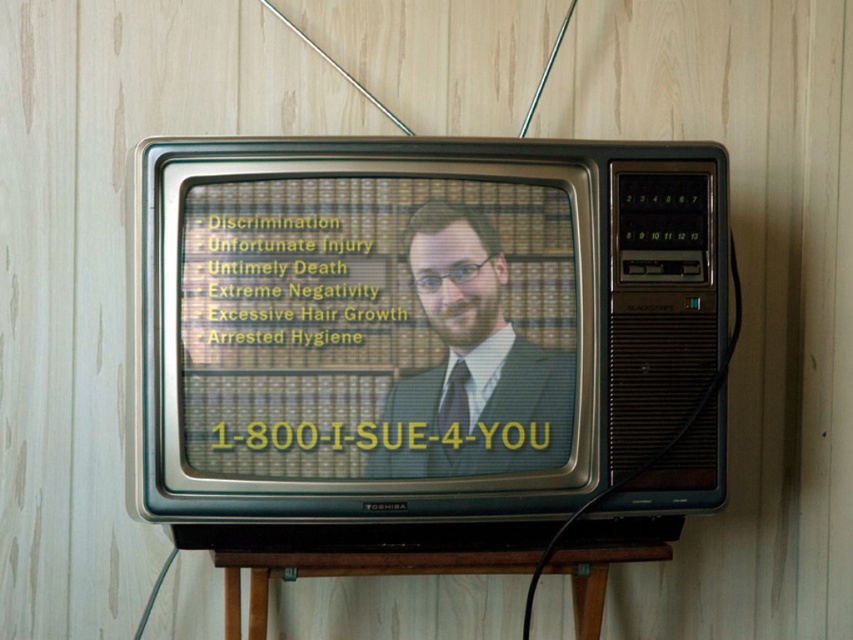
Based on the photo, is yellow text on crt screen at center behind matte black suit at center?

No, yellow text on crt screen at center is closer to the viewer.

The image size is (853, 640). In order to click on yellow text on crt screen at center in this screenshot , I will do `click(376, 326)`.

The height and width of the screenshot is (640, 853). Find the location of `yellow text on crt screen at center`. yellow text on crt screen at center is located at coordinates (376, 326).